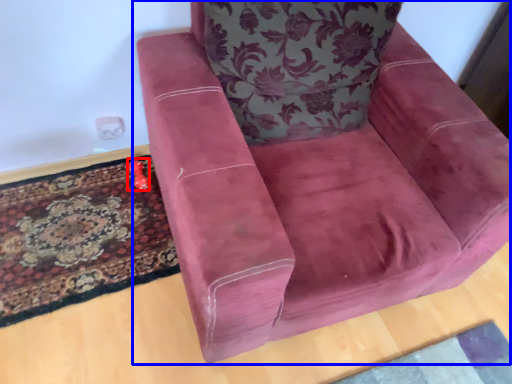
Question: Which point is closer to the camera, toy (highlighted by a red box) or chair (highlighted by a blue box)?

Choices:
 (A) toy
 (B) chair

Answer: (B)